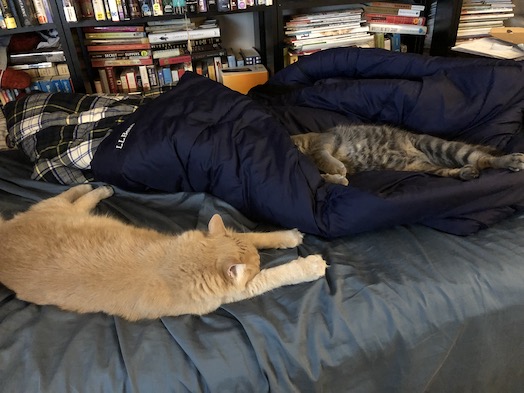
I want to click on bed top, so click(405, 268).